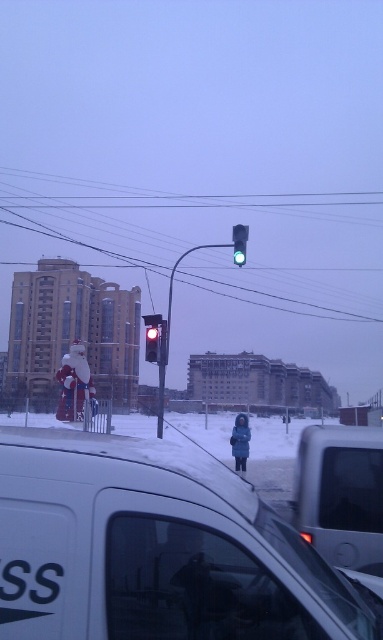
You are a pedestrian standing at the traffic light in the urban winter scene. You want to walk to the point marked as point (x=340, y=540) and then to point (x=240, y=448). Which point should you reach first according to their positions?

You should reach point (x=340, y=540) first because it is in front of point (x=240, y=448), meaning it is closer to your starting position at the traffic light.